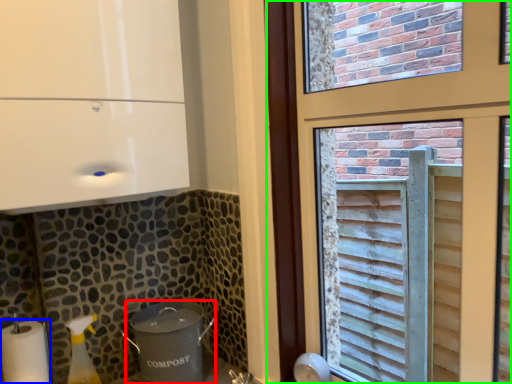
Question: Which object is positioned closest to appliance (highlighted by a red box)? Select from paper towel (highlighted by a blue box) and window (highlighted by a green box).

Choices:
 (A) paper towel
 (B) window

Answer: (A)